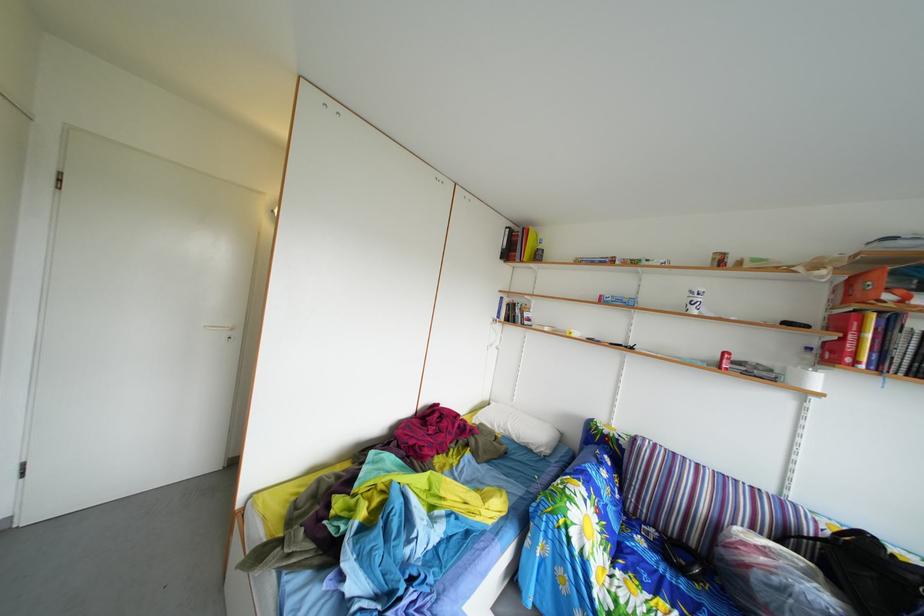
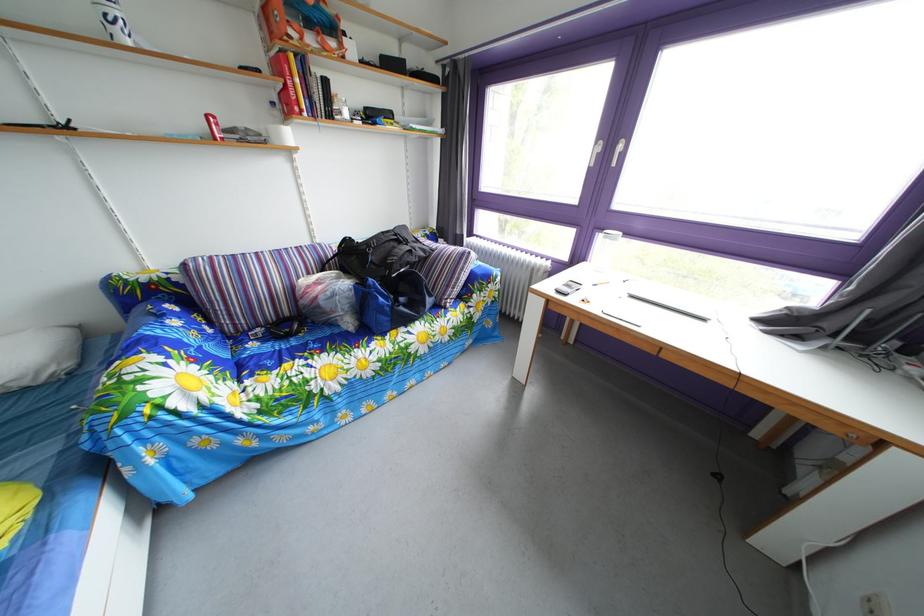
In the second image, find the point that corresponds to point 820,358 in the first image.

(284, 111)